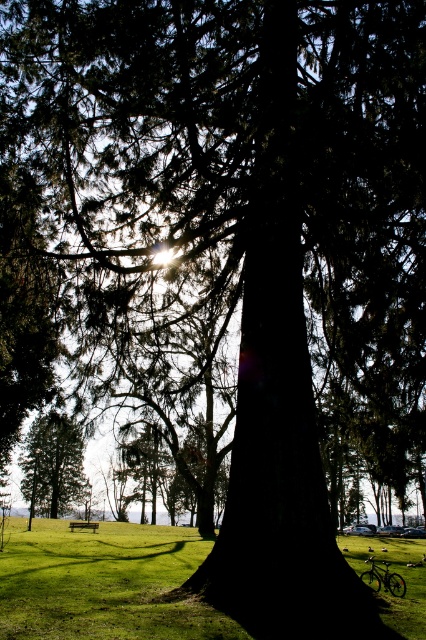
Is green grass at center to the left of green matte tree at center from the viewer's perspective?

No, green grass at center is not to the left of green matte tree at center.

Can you confirm if green grass at center is smaller than green matte tree at center?

Incorrect, green grass at center is not smaller in size than green matte tree at center.

Where is `green grass at center`? Image resolution: width=426 pixels, height=640 pixels. green grass at center is located at coordinates (103, 582).

Can you confirm if green matte tree at center is taller than wooden bench at lower center?

Indeed, green matte tree at center has a greater height compared to wooden bench at lower center.

Where is `green matte tree at center`? green matte tree at center is located at coordinates (54, 465).

You are a GUI agent. You are given a task and a screenshot of the screen. Output one action in this format:
    pyautogui.click(x=<x>, y=<y>)
    Task: Click on the green matte tree at center
    This screenshot has height=640, width=426.
    Given the screenshot: What is the action you would take?
    pyautogui.click(x=54, y=465)

Is green grass at center above wooden bench at lower center?

Yes, green grass at center is above wooden bench at lower center.

Which is behind, point (80, 557) or point (94, 522)?

Positioned behind is point (94, 522).

The height and width of the screenshot is (640, 426). Identify the location of green grass at center. (103, 582).